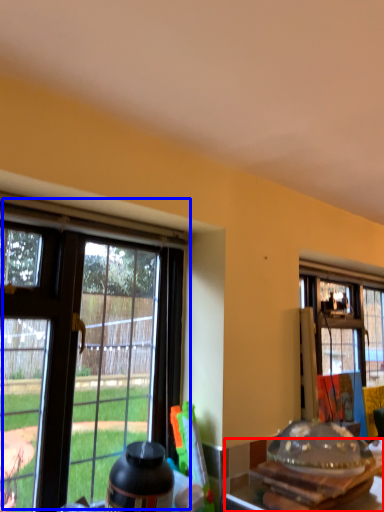
Question: Which point is further to the camera, kitchen & dining room table (highlighted by a red box) or window (highlighted by a blue box)?

Choices:
 (A) kitchen & dining room table
 (B) window

Answer: (A)